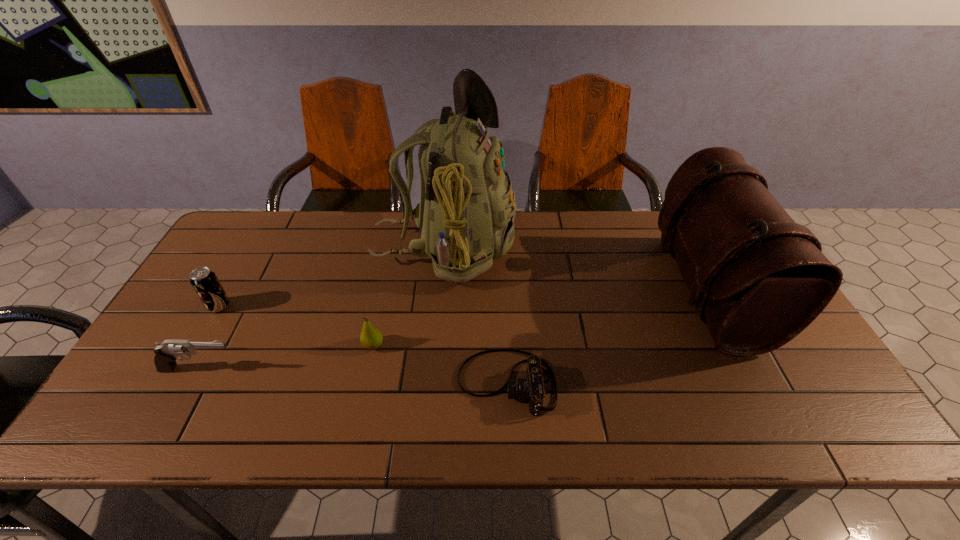
You are a GUI agent. You are given a task and a screenshot of the screen. Output one action in this format:
    pyautogui.click(x=<x>, y=<y>)
    Task: Click on the vacant position located 0.160m on the front-facing side of the satchel
    
    Given the screenshot: What is the action you would take?
    pyautogui.click(x=607, y=289)

At what (x,y) coordinates should I click in order to perform the action: click on free point located on the back of the soda can. Please return your answer as a coordinate pair (x, y). The image size is (960, 540). Looking at the image, I should click on (257, 240).

I want to click on free space located at the muzzle of the gun, so click(287, 370).

Identify the location of blank space located 0.240m on the left of the pear. (269, 345).

Where is `vacant space located 0.290m on the front-facing side of the shortest object`? This screenshot has width=960, height=540. vacant space located 0.290m on the front-facing side of the shortest object is located at coordinates (336, 383).

Where is `vacant region located 0.350m on the front-facing side of the shortest object`? The width and height of the screenshot is (960, 540). vacant region located 0.350m on the front-facing side of the shortest object is located at coordinates (310, 383).

At what (x,y) coordinates should I click in order to perform the action: click on vacant space located on the front-facing side of the shortest object. Please return your answer as a coordinate pair (x, y). The image size is (960, 540). Looking at the image, I should click on pos(298,383).

Image resolution: width=960 pixels, height=540 pixels. What are the coordinates of `backpack present at the far edge` in the screenshot? It's located at (466, 213).

This screenshot has height=540, width=960. Find the location of `satchel present at the far edge`. satchel present at the far edge is located at coordinates (758, 279).

This screenshot has height=540, width=960. In order to click on object situated at the near edge in this screenshot , I will do `click(532, 387)`.